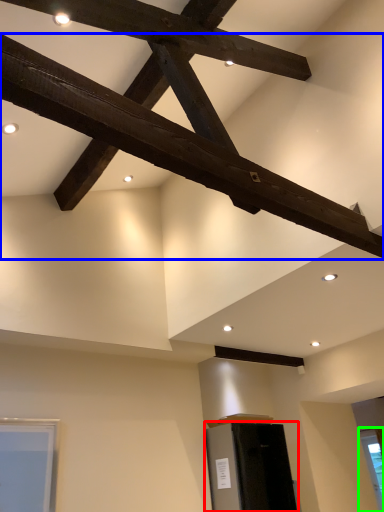
Question: Based on their relative distances, which object is farther from furniture (highlighted by a red box)? Choose from beam (highlighted by a blue box) and window (highlighted by a green box).

Choices:
 (A) beam
 (B) window

Answer: (A)